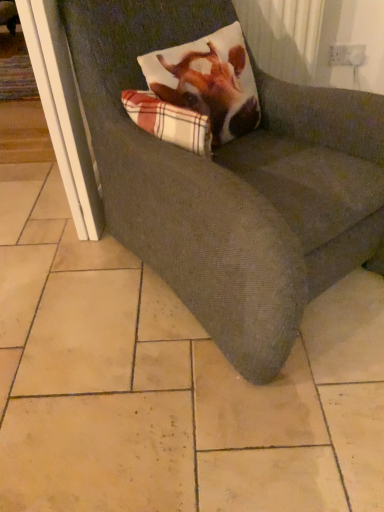
Question: Is the surface of plaid fabric pillow at upper center in direct contact with textured gray couch at center?

Choices:
 (A) yes
 (B) no

Answer: (B)

Question: Is plaid fabric pillow at upper center at the right side of textured gray couch at center?

Choices:
 (A) no
 (B) yes

Answer: (A)

Question: Is plaid fabric pillow at upper center turned away from textured gray couch at center?

Choices:
 (A) yes
 (B) no

Answer: (A)

Question: Can you confirm if plaid fabric pillow at upper center is shorter than textured gray couch at center?

Choices:
 (A) yes
 (B) no

Answer: (A)

Question: Is plaid fabric pillow at upper center thinner than textured gray couch at center?

Choices:
 (A) no
 (B) yes

Answer: (B)

Question: From a real-world perspective, is textured gray couch at center physically located above or below white plastic screen door at left?

Choices:
 (A) above
 (B) below

Answer: (A)

Question: In the image, is textured gray couch at center positioned in front of or behind white plastic screen door at left?

Choices:
 (A) behind
 (B) front

Answer: (B)

Question: Considering the relative positions of textured gray couch at center and white plastic screen door at left in the image provided, is textured gray couch at center to the left or to the right of white plastic screen door at left?

Choices:
 (A) right
 (B) left

Answer: (A)

Question: In terms of width, does textured gray couch at center look wider or thinner when compared to white plastic screen door at left?

Choices:
 (A) wide
 (B) thin

Answer: (A)

Question: From a real-world perspective, relative to plaid fabric pillow at upper center, is white plastic screen door at left vertically above or below?

Choices:
 (A) above
 (B) below

Answer: (B)

Question: Based on their positions, is white plastic screen door at left located to the left or right of plaid fabric pillow at upper center?

Choices:
 (A) right
 (B) left

Answer: (B)

Question: Considering the positions of white plastic screen door at left and plaid fabric pillow at upper center in the image, is white plastic screen door at left bigger or smaller than plaid fabric pillow at upper center?

Choices:
 (A) small
 (B) big

Answer: (B)

Question: Is point (49, 88) closer or farther from the camera than point (187, 137)?

Choices:
 (A) closer
 (B) farther

Answer: (B)

Question: Is plaid fabric pillow at upper center inside the boundaries of white plastic screen door at left, or outside?

Choices:
 (A) outside
 (B) inside

Answer: (A)

Question: Based on their sizes in the image, would you say plaid fabric pillow at upper center is bigger or smaller than white plastic screen door at left?

Choices:
 (A) big
 (B) small

Answer: (B)